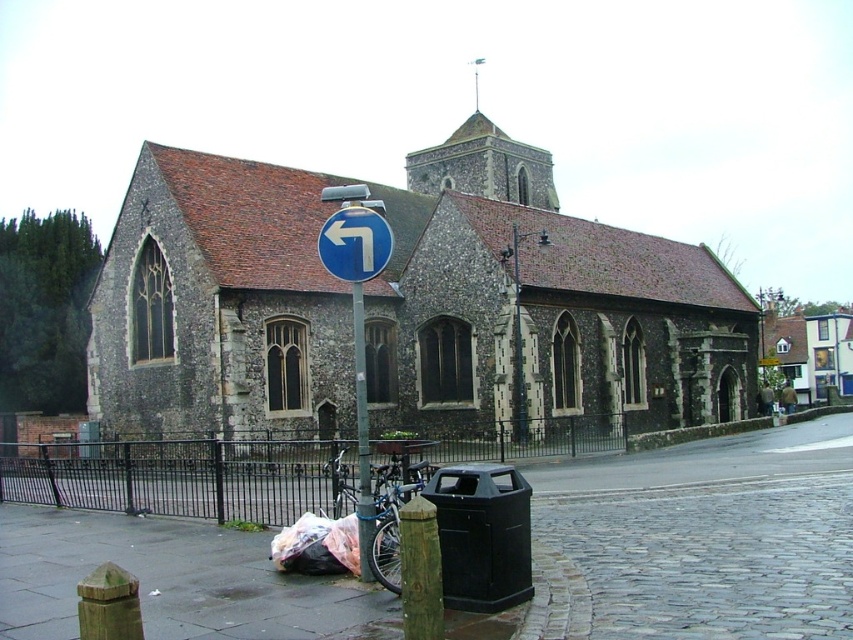
Is smooth concrete pavement at lower left taller than plastic bag at lower left?

Correct, smooth concrete pavement at lower left is much taller as plastic bag at lower left.

Who is positioned more to the right, smooth concrete pavement at lower left or plastic bag at lower left?

Positioned to the right is smooth concrete pavement at lower left.

The image size is (853, 640). Describe the element at coordinates (692, 541) in the screenshot. I see `smooth concrete pavement at lower left` at that location.

At what (x,y) coordinates should I click in order to perform the action: click on smooth concrete pavement at lower left. Please return your answer as a coordinate pair (x, y). Looking at the image, I should click on (692, 541).

Does blue metallic bicycle at lower left have a smaller size compared to blue plastic traffic sign at left?

Yes.

The height and width of the screenshot is (640, 853). What do you see at coordinates (392, 515) in the screenshot?
I see `blue metallic bicycle at lower left` at bounding box center [392, 515].

Where is `blue metallic bicycle at lower left`? Image resolution: width=853 pixels, height=640 pixels. blue metallic bicycle at lower left is located at coordinates (392, 515).

Find the location of a particular element. This screenshot has width=853, height=640. blue metallic bicycle at lower left is located at coordinates (392, 515).

Can you confirm if black metal fence at lower left is positioned below blue plastic traffic sign at left?

Yes, black metal fence at lower left is below blue plastic traffic sign at left.

Who is positioned more to the left, black metal fence at lower left or blue plastic traffic sign at left?

From the viewer's perspective, black metal fence at lower left appears more on the left side.

Is point (97, 465) less distant than point (367, 253)?

No.

Identify the location of black metal fence at lower left. (183, 476).